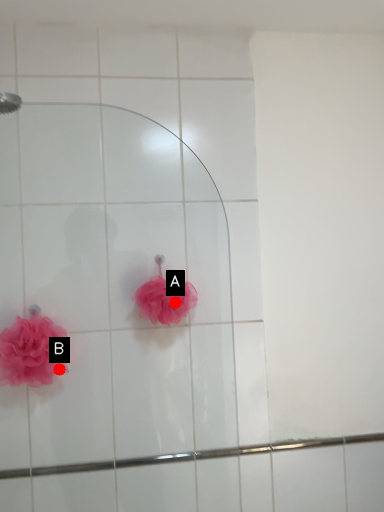
Question: Two points are circled on the image, labeled by A and B beside each circle. Which point is farther to the camera?

Choices:
 (A) A is further
 (B) B is further

Answer: (A)